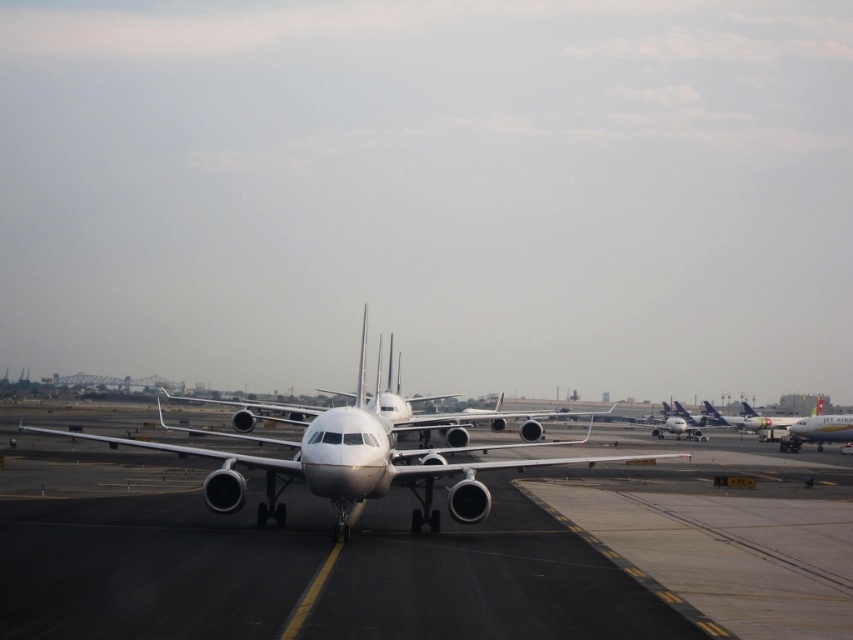
Question: Among these points, which one is farthest from the camera?

Choices:
 (A) (x=850, y=413)
 (B) (x=374, y=476)
 (C) (x=184, y=582)

Answer: (A)

Question: Can you confirm if white glossy tarmac at center is positioned to the right of white glossy airplane at right?

Choices:
 (A) yes
 (B) no

Answer: (B)

Question: Estimate the real-world distances between objects in this image. Which object is farther from the white glossy tarmac at center?

Choices:
 (A) white matte airplane at center
 (B) white glossy airplane at right

Answer: (B)

Question: Which object appears closest to the camera in this image?

Choices:
 (A) white matte airplane at center
 (B) white glossy airplane at right
 (C) white glossy tarmac at center

Answer: (C)

Question: Does white matte airplane at center have a greater width compared to white glossy airplane at right?

Choices:
 (A) yes
 (B) no

Answer: (A)

Question: Is white glossy tarmac at center above white glossy airplane at right?

Choices:
 (A) no
 (B) yes

Answer: (B)